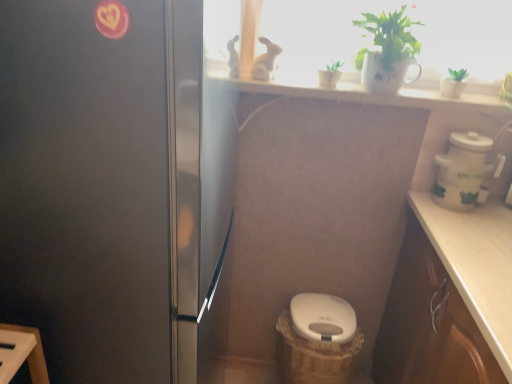
Image resolution: width=512 pixels, height=384 pixels. In order to click on empty space that is ontop of white glossy toilet bowl at center (from a real-world perspective) in this screenshot , I will do `click(326, 310)`.